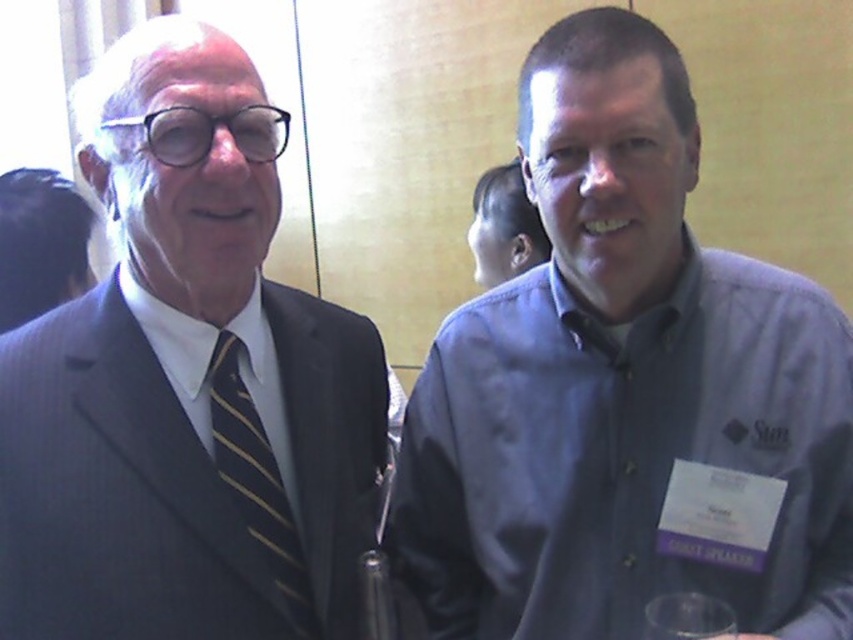
You are taking a photo of the two people in the scene. You want to focus on the matte black suit at left and the black striped tie at left. Which one should you adjust your camera focus to first to ensure both are in focus?

The matte black suit at left is closer to the viewer than the black striped tie at left, so you should focus on the matte black suit at left first to ensure both are in focus.

You are a photographer setting up for a group photo. You notice the blue cotton shirt at center and the matte black suit at left. Which of these two is taller?

The blue cotton shirt at center is much taller than the matte black suit at left according to the description.

You are organizing a charity event and need to ensure that all participants wear attire with specific width requirements. The rule states that the suit must be wider than the tie. Based on the image provided, does the matte black suit at left meet the requirement compared to the black striped tie at left?

The matte black suit at left has a width that surpasses the black striped tie at left, so it meets the requirement.